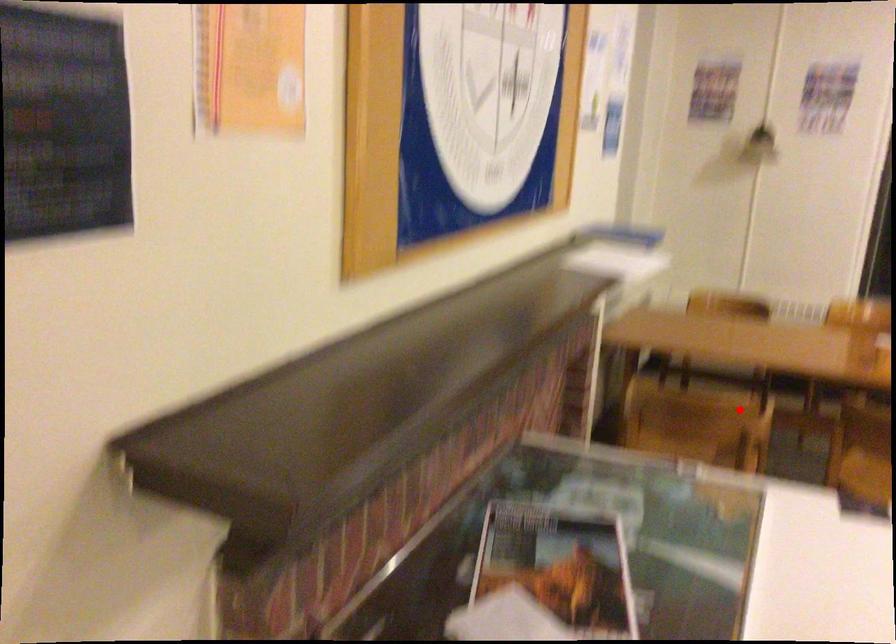
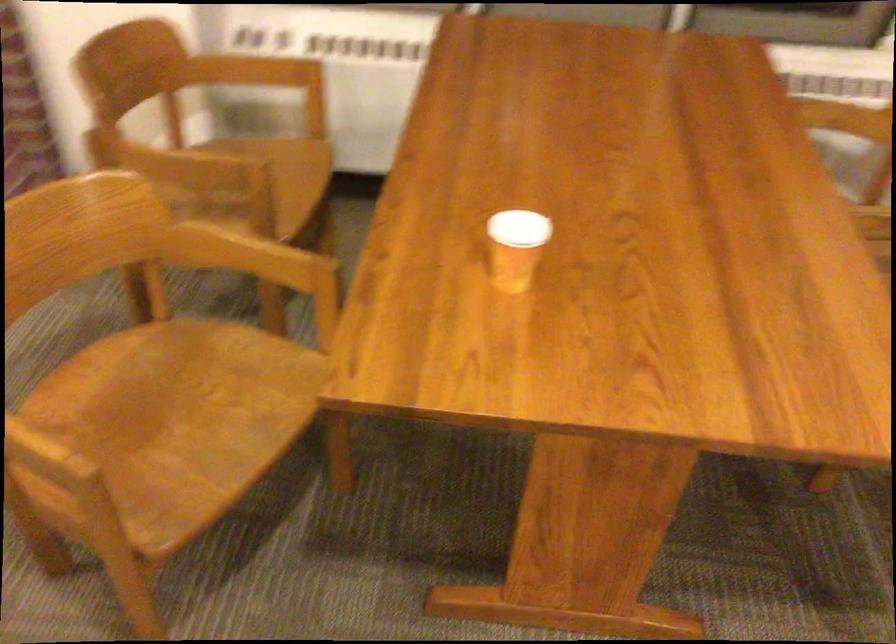
Question: I am providing you with two images of the same scene from different viewpoints. A red point is shown in image1. For the corresponding object point in image2, is it positioned nearer or farther from the camera?

Choices:
 (A) Nearer
 (B) Farther

Answer: (A)